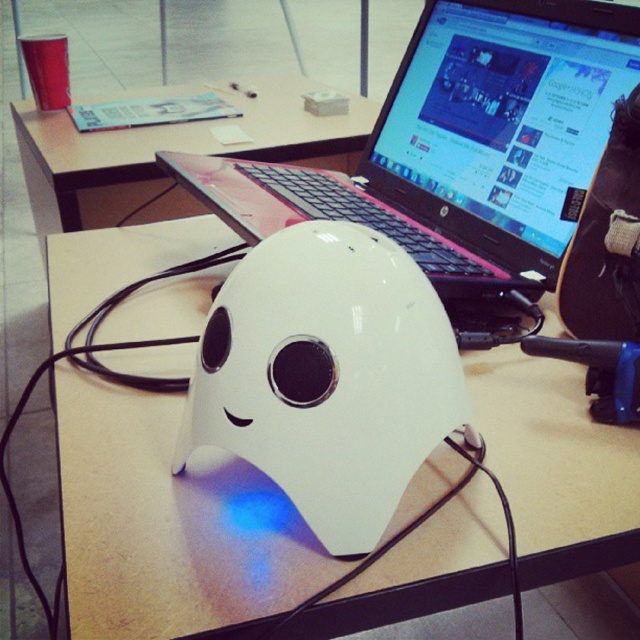
Question: Among these points, which one is nearest to the camera?

Choices:
 (A) (435, 154)
 (B) (349, 353)

Answer: (B)

Question: Is white glossy mask at center above white glossy mouse at center?

Choices:
 (A) no
 (B) yes

Answer: (B)

Question: Which point is farther from the camera taking this photo?

Choices:
 (A) (515, 212)
 (B) (102, 186)
 (C) (388, 324)
 (D) (276, 561)

Answer: (B)

Question: Which object is the closest to the white glossy mouse at center?

Choices:
 (A) pink plastic laptop at center
 (B) white glossy mask at center
 (C) white matte table at center

Answer: (B)

Question: Is white glossy mask at center to the left of white glossy mouse at center from the viewer's perspective?

Choices:
 (A) no
 (B) yes

Answer: (B)

Question: Does white glossy mask at center have a larger size compared to white matte table at center?

Choices:
 (A) no
 (B) yes

Answer: (A)